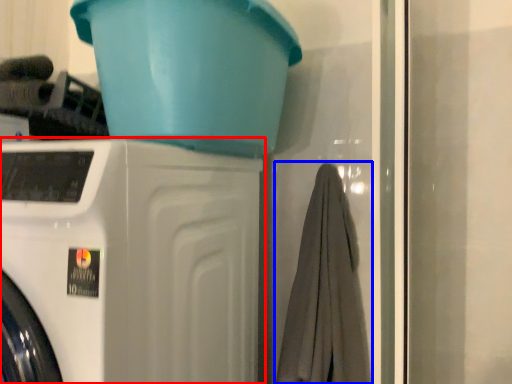
Question: Which of the following is the farthest to the observer, washing machine (highlighted by a red box) or bath towel (highlighted by a blue box)?

Choices:
 (A) washing machine
 (B) bath towel

Answer: (B)